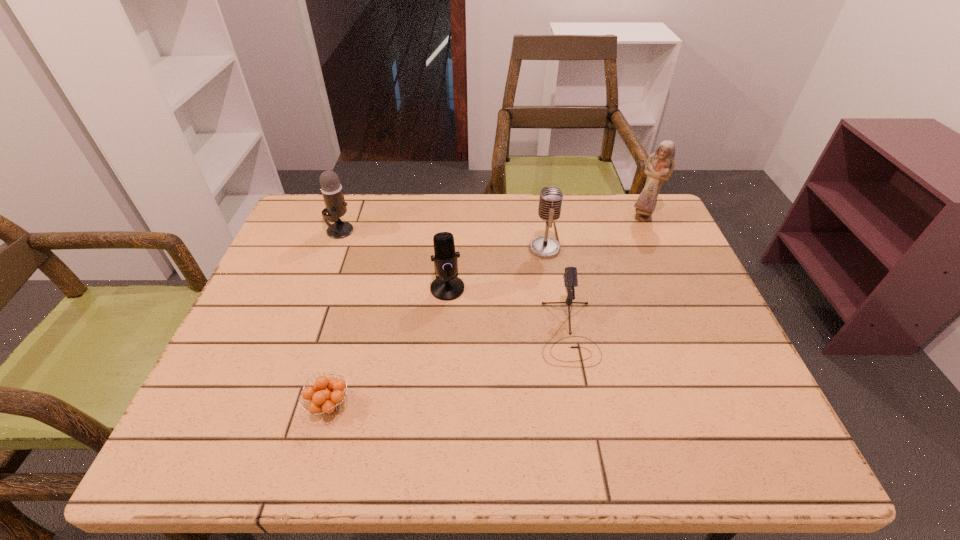
The height and width of the screenshot is (540, 960). Find the location of `free space located on the stand of the second microphone from left to right`. free space located on the stand of the second microphone from left to right is located at coordinates (444, 326).

You are a GUI agent. You are given a task and a screenshot of the screen. Output one action in this format:
    pyautogui.click(x=<x>, y=<y>)
    Task: Click on the vacant region located 0.100m on the stand of the second shortest object
    
    Given the screenshot: What is the action you would take?
    pyautogui.click(x=582, y=409)

Find the location of a particular element. The height and width of the screenshot is (540, 960). vacant space located 0.070m on the right of the nearest object is located at coordinates (386, 405).

Where is `figurine positioned at the far edge`? The width and height of the screenshot is (960, 540). figurine positioned at the far edge is located at coordinates (659, 166).

Locate an element on the screen. object located in the near edge section of the desktop is located at coordinates (323, 400).

Where is `object that is at the left edge`? object that is at the left edge is located at coordinates (331, 189).

The height and width of the screenshot is (540, 960). I want to click on object located in the right edge section of the desktop, so click(659, 166).

What are the coordinates of `object situated at the far left corner` in the screenshot? It's located at (331, 189).

I want to click on object present at the far right corner, so click(659, 166).

This screenshot has width=960, height=540. I want to click on vacant position at the far edge of the desktop, so click(540, 223).